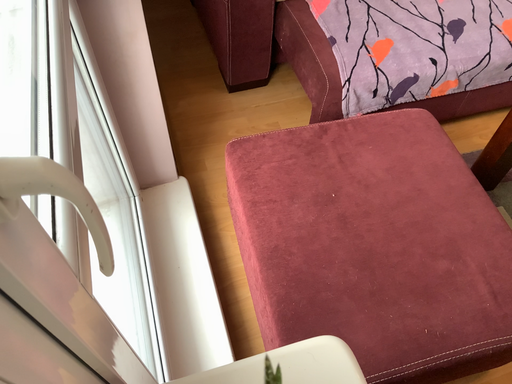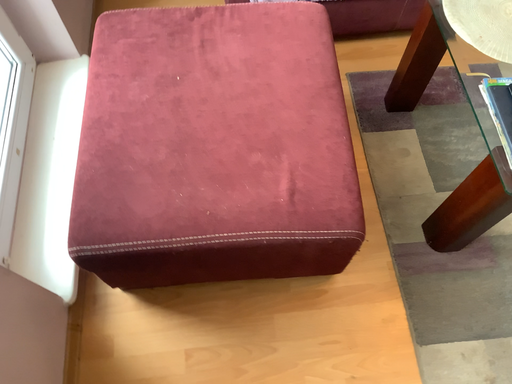
Question: How did the camera likely rotate when shooting the video?

Choices:
 (A) rotated right
 (B) rotated left

Answer: (B)